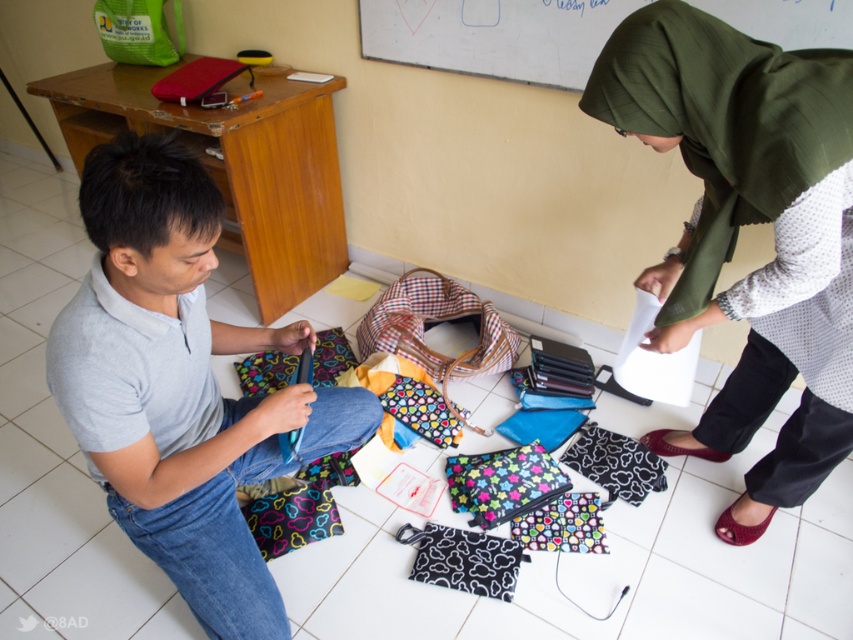
Based on the scene described, which object is positioned to the right of the other between the green fabric hijab at upper right and the gray matte shirt at center?

The green fabric hijab at upper right is positioned to the right of the gray matte shirt at center.

You are a photographer trying to capture a closeup shot of the green fabric hijab at upper right and the gray matte shirt at center. Which object should you focus on first to ensure it is in sharp focus?

The green fabric hijab at upper right is closer to the viewer than the gray matte shirt at center, so you should focus on the green fabric hijab at upper right first to ensure it is in sharp focus.

You are standing at the origin point of the scene. Which of the two points, point [759,221] or point [294,408], is located further away from you?

Point [759,221] is located further away from you because it is behind point [294,408].